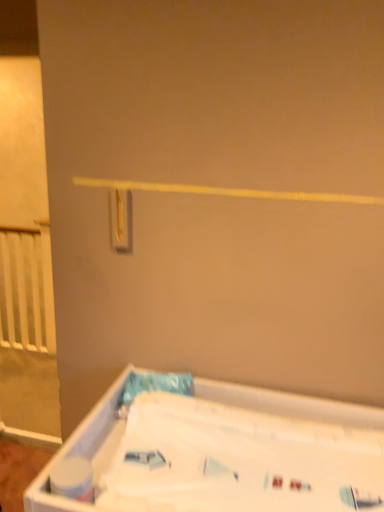
At what (x,y) coordinates should I click in order to perform the action: click on white plastic bathtub at lower right. Please return your answer as a coordinate pair (x, y). This screenshot has width=384, height=512. Looking at the image, I should click on (224, 453).

Image resolution: width=384 pixels, height=512 pixels. Describe the element at coordinates (224, 453) in the screenshot. I see `white plastic bathtub at lower right` at that location.

What do you see at coordinates (73, 479) in the screenshot? The height and width of the screenshot is (512, 384). I see `white matte toilet paper at lower left` at bounding box center [73, 479].

Locate an element on the screen. This screenshot has width=384, height=512. gold metallic light switch at upper center is located at coordinates tap(121, 219).

Between point (87, 428) and point (78, 462), which one is positioned in front?

The point (78, 462) is in front.

How many degrees apart are the facing directions of white plastic bathtub at lower right and white matte toilet paper at lower left?

The angle between the facing direction of white plastic bathtub at lower right and the facing direction of white matte toilet paper at lower left is 1.7 degrees.

Considering the sizes of objects white plastic bathtub at lower right and white matte toilet paper at lower left in the image provided, who is smaller, white plastic bathtub at lower right or white matte toilet paper at lower left?

With smaller size is white matte toilet paper at lower left.

Does white plastic bathtub at lower right touch white matte toilet paper at lower left?

No, white plastic bathtub at lower right is not in contact with white matte toilet paper at lower left.

Is white plastic bathtub at lower right to the right of gold metallic light switch at upper center from the viewer's perspective?

Indeed, white plastic bathtub at lower right is positioned on the right side of gold metallic light switch at upper center.

Does point (118, 488) come behind point (128, 197)?

No, (118, 488) is in front of (128, 197).

Would you consider white plastic bathtub at lower right to be distant from gold metallic light switch at upper center?

No, white plastic bathtub at lower right is in close proximity to gold metallic light switch at upper center.

Between gold metallic light switch at upper center and white plastic bathtub at lower right, which one appears on the left side from the viewer's perspective?

gold metallic light switch at upper center is more to the left.

Is gold metallic light switch at upper center facing away from white plastic bathtub at lower right?

No.

In terms of height, does gold metallic light switch at upper center look taller or shorter compared to white plastic bathtub at lower right?

In the image, gold metallic light switch at upper center appears to be shorter than white plastic bathtub at lower right.

From the image's perspective, is white matte toilet paper at lower left located above or below white plastic bathtub at lower right?

white matte toilet paper at lower left is situated higher than white plastic bathtub at lower right in the image.

Which of these two, white matte toilet paper at lower left or white plastic bathtub at lower right, is smaller?

With smaller size is white matte toilet paper at lower left.

Which is more to the right, white matte toilet paper at lower left or white plastic bathtub at lower right?

Positioned to the right is white plastic bathtub at lower right.

Is white matte toilet paper at lower left located outside white plastic bathtub at lower right?

No, white matte toilet paper at lower left is not entirely external to white plastic bathtub at lower right.

Is white matte toilet paper at lower left oriented towards gold metallic light switch at upper center?

No, white matte toilet paper at lower left is not turned towards gold metallic light switch at upper center.

Is white matte toilet paper at lower left in contact with gold metallic light switch at upper center?

They are not placed beside each other.

Considering the points (66, 490) and (117, 236), which point is behind, point (66, 490) or point (117, 236)?

Point (117, 236)

Which object is more forward, white matte toilet paper at lower left or gold metallic light switch at upper center?

Positioned in front is white matte toilet paper at lower left.

Is gold metallic light switch at upper center in front of or behind white matte toilet paper at lower left in the image?

gold metallic light switch at upper center is behind white matte toilet paper at lower left.

From a real-world perspective, between gold metallic light switch at upper center and white matte toilet paper at lower left, who is vertically lower?

In real-world perspective, white matte toilet paper at lower left is lower.

In the scene shown: Does gold metallic light switch at upper center have a lesser height compared to white matte toilet paper at lower left?

No.

Identify the location of toilet paper above the white plastic bathtub at lower right (from a real-world perspective). (73, 479).

What are the coordinates of `light switch behind the white plastic bathtub at lower right` in the screenshot? It's located at (121, 219).

Based on the photo, based on their spatial positions, is white plastic bathtub at lower right or gold metallic light switch at upper center further from white matte toilet paper at lower left?

gold metallic light switch at upper center lies further to white matte toilet paper at lower left than the other object.

Which object lies nearer to the anchor point gold metallic light switch at upper center, white plastic bathtub at lower right or white matte toilet paper at lower left?

white plastic bathtub at lower right.

Estimate the real-world distances between objects in this image. Which object is further from white plastic bathtub at lower right, white matte toilet paper at lower left or gold metallic light switch at upper center?

gold metallic light switch at upper center lies further to white plastic bathtub at lower right than the other object.

Estimate the real-world distances between objects in this image. Which object is closer to gold metallic light switch at upper center, white matte toilet paper at lower left or white plastic bathtub at lower right?

The object closer to gold metallic light switch at upper center is white plastic bathtub at lower right.

Estimate the real-world distances between objects in this image. Which object is closer to white plastic bathtub at lower right, gold metallic light switch at upper center or white matte toilet paper at lower left?

Based on the image, white matte toilet paper at lower left appears to be nearer to white plastic bathtub at lower right.

Estimate the real-world distances between objects in this image. Which object is closer to white matte toilet paper at lower left, gold metallic light switch at upper center or white plastic bathtub at lower right?

white plastic bathtub at lower right.

Find the location of `toilet paper between gold metallic light switch at upper center and white plastic bathtub at lower right vertically`. toilet paper between gold metallic light switch at upper center and white plastic bathtub at lower right vertically is located at coordinates 73,479.